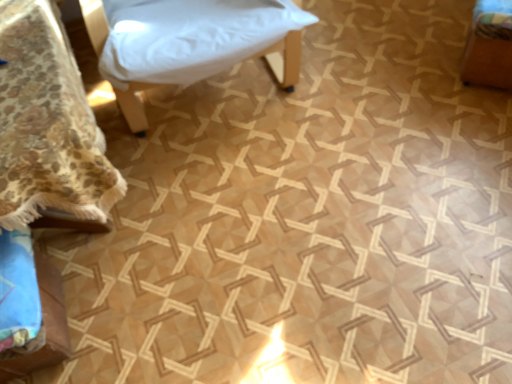
You are a GUI agent. You are given a task and a screenshot of the screen. Output one action in this format:
    pyautogui.click(x=<x>, y=<y>)
    Task: Click on the vacant area that is in front of white fabric cushion at upper center, which is counted as the second furniture, starting from the right
    
    Given the screenshot: What is the action you would take?
    point(268,214)